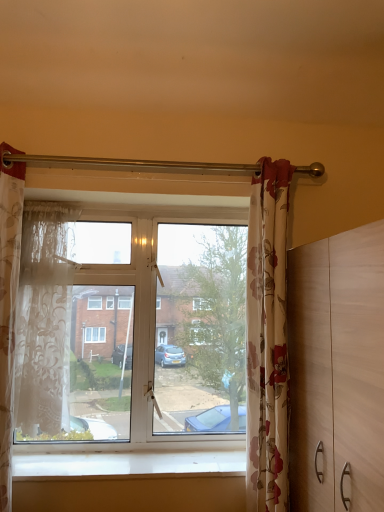
You are a GUI agent. You are given a task and a screenshot of the screen. Output one action in this format:
    pyautogui.click(x=<x>, y=<y>)
    Task: Click on the white smooth window sill at lower center
    This screenshot has height=512, width=384.
    Given the screenshot: What is the action you would take?
    pyautogui.click(x=129, y=464)

Measure the distance between light brown wooden dresser at right and camera.

The depth of light brown wooden dresser at right is 35.26 inches.

This screenshot has height=512, width=384. What are the coordinates of `light brown wooden dresser at right` in the screenshot? It's located at (337, 371).

At what (x,y) coordinates should I click in order to perform the action: click on sheer white lace curtain at left, the second curtain when ordered from left to right. Please return your answer as a coordinate pair (x, y). This screenshot has width=384, height=512. Looking at the image, I should click on (44, 321).

Identify the location of floral fabric curtain at right, which is counted as the first curtain, starting from the right. This screenshot has width=384, height=512. (267, 339).

Find the location of a particular element. The width and height of the screenshot is (384, 512). white smooth window sill at lower center is located at coordinates (129, 464).

Is translucent floral fabric curtain at left, the 3th curtain viewed from the right, facing towards sheer white lace curtain at left, the second curtain when ordered from left to right?

No, translucent floral fabric curtain at left, the 3th curtain viewed from the right, is not aimed at sheer white lace curtain at left, the second curtain when ordered from left to right.

Between translucent floral fabric curtain at left, the first curtain from the left, and sheer white lace curtain at left, the 2th curtain from the right, which one has smaller width?

With smaller width is sheer white lace curtain at left, the 2th curtain from the right.

Find the location of a particular element. The height and width of the screenshot is (512, 384). curtain on the left of sheer white lace curtain at left, the second curtain when ordered from left to right is located at coordinates (8, 306).

From the image's perspective, which one is positioned higher, sheer white lace curtain at left, the 2th curtain from the right, or transparent glass window at center?

sheer white lace curtain at left, the 2th curtain from the right, from the image's perspective.

Consider the image. From a real-world perspective, who is located lower, sheer white lace curtain at left, the second curtain when ordered from left to right, or transparent glass window at center?

transparent glass window at center is physically lower.

Does sheer white lace curtain at left, the 2th curtain from the right, contain transparent glass window at center?

No, sheer white lace curtain at left, the 2th curtain from the right, does not contain transparent glass window at center.

Is sheer white lace curtain at left, the second curtain when ordered from left to right, facing towards transparent glass window at center?

No.

Which is more to the left, light brown wooden dresser at right or transparent glass window at center?

From the viewer's perspective, transparent glass window at center appears more on the left side.

From a real-world perspective, which is physically below, light brown wooden dresser at right or transparent glass window at center?

light brown wooden dresser at right, from a real-world perspective.

Considering the relative sizes of light brown wooden dresser at right and transparent glass window at center in the image provided, is light brown wooden dresser at right bigger than transparent glass window at center?

Yes.

Is transparent glass window at center next to translucent floral fabric curtain at left, the first curtain from the left?

No, transparent glass window at center is not in contact with translucent floral fabric curtain at left, the first curtain from the left.

Considering the relative positions of transparent glass window at center and translucent floral fabric curtain at left, the first curtain from the left, in the image provided, is transparent glass window at center to the right of translucent floral fabric curtain at left, the first curtain from the left, from the viewer's perspective?

→ Indeed, transparent glass window at center is positioned on the right side of translucent floral fabric curtain at left, the first curtain from the left.

From the picture: Is transparent glass window at center inside the boundaries of translucent floral fabric curtain at left, the 3th curtain viewed from the right, or outside?

The correct answer is: outside.

Is light brown wooden dresser at right bigger or smaller than translucent floral fabric curtain at left, the first curtain from the left?

Clearly, light brown wooden dresser at right is larger in size than translucent floral fabric curtain at left, the first curtain from the left.

Is point (330, 499) farther from viewer compared to point (4, 204)?

That is False.

Is the depth of light brown wooden dresser at right less than that of translucent floral fabric curtain at left, the 3th curtain viewed from the right?

That is True.

Does light brown wooden dresser at right have a lesser height compared to white smooth window sill at lower center?

No, light brown wooden dresser at right is not shorter than white smooth window sill at lower center.

Which is in front, point (306, 371) or point (34, 457)?

Point (306, 371)

Locate an element on the screen. The width and height of the screenshot is (384, 512). dresser above the white smooth window sill at lower center (from the image's perspective) is located at coordinates (337, 371).

From a real-world perspective, is light brown wooden dresser at right positioned under white smooth window sill at lower center based on gravity?

Actually, light brown wooden dresser at right is physically above white smooth window sill at lower center in the real world.

Is there a large distance between floral fabric curtain at right, which is counted as the first curtain, starting from the right, and white smooth window sill at lower center?

No, there isn't a large distance between floral fabric curtain at right, which is counted as the first curtain, starting from the right, and white smooth window sill at lower center.

Looking at this image, is floral fabric curtain at right, which ranks as the third curtain in left-to-right order, not inside white smooth window sill at lower center?

Yes, floral fabric curtain at right, which ranks as the third curtain in left-to-right order, is outside of white smooth window sill at lower center.

Considering the points (272, 416) and (143, 459), which point is behind, point (272, 416) or point (143, 459)?

The point (143, 459) is more distant.

This screenshot has height=512, width=384. Identify the location of curtain that is the 1st one when counting rightward from the translucent floral fabric curtain at left, the first curtain from the left. (44, 321).

Find the location of a particular element. Image resolution: width=384 pixels, height=512 pixels. window lying below the sheer white lace curtain at left, the 2th curtain from the right (from the image's perspective) is located at coordinates (137, 343).

Looking at the image, which one is located closer to white smooth window sill at lower center, sheer white lace curtain at left, the second curtain when ordered from left to right, or light brown wooden dresser at right?

The object closer to white smooth window sill at lower center is sheer white lace curtain at left, the second curtain when ordered from left to right.

From the picture: Based on their spatial positions, is sheer white lace curtain at left, the second curtain when ordered from left to right, or floral fabric curtain at right, which ranks as the third curtain in left-to-right order, further from light brown wooden dresser at right?

sheer white lace curtain at left, the second curtain when ordered from left to right, lies further to light brown wooden dresser at right than the other object.

Considering their positions, is white smooth window sill at lower center positioned further to floral fabric curtain at right, which ranks as the third curtain in left-to-right order, than translucent floral fabric curtain at left, the first curtain from the left?

translucent floral fabric curtain at left, the first curtain from the left, lies further to floral fabric curtain at right, which ranks as the third curtain in left-to-right order, than the other object.

Estimate the real-world distances between objects in this image. Which object is closer to sheer white lace curtain at left, the second curtain when ordered from left to right, transparent glass window at center or floral fabric curtain at right, which is counted as the first curtain, starting from the right?

The object closer to sheer white lace curtain at left, the second curtain when ordered from left to right, is transparent glass window at center.

Based on their spatial positions, is white smooth window sill at lower center or transparent glass window at center further from light brown wooden dresser at right?

Based on the image, transparent glass window at center appears to be further to light brown wooden dresser at right.

Which object lies further to the anchor point white smooth window sill at lower center, translucent floral fabric curtain at left, the first curtain from the left, or transparent glass window at center?

translucent floral fabric curtain at left, the first curtain from the left, is further to white smooth window sill at lower center.

Considering their positions, is translucent floral fabric curtain at left, the 3th curtain viewed from the right, positioned closer to floral fabric curtain at right, which ranks as the third curtain in left-to-right order, than transparent glass window at center?

Among the two, transparent glass window at center is located nearer to floral fabric curtain at right, which ranks as the third curtain in left-to-right order.

Considering their positions, is white smooth window sill at lower center positioned closer to sheer white lace curtain at left, the second curtain when ordered from left to right, than translucent floral fabric curtain at left, the 3th curtain viewed from the right?

Among the two, translucent floral fabric curtain at left, the 3th curtain viewed from the right, is located nearer to sheer white lace curtain at left, the second curtain when ordered from left to right.

Find the location of a particular element. window between sheer white lace curtain at left, the 2th curtain from the right, and floral fabric curtain at right, which is counted as the first curtain, starting from the right is located at coordinates (137, 343).

Identify the location of window between translucent floral fabric curtain at left, the 3th curtain viewed from the right, and floral fabric curtain at right, which is counted as the first curtain, starting from the right, in the horizontal direction. (137, 343).

Find the location of a particular element. The width and height of the screenshot is (384, 512). curtain situated between sheer white lace curtain at left, the 2th curtain from the right, and light brown wooden dresser at right from left to right is located at coordinates (267, 339).

Image resolution: width=384 pixels, height=512 pixels. In order to click on window between sheer white lace curtain at left, the second curtain when ordered from left to right, and white smooth window sill at lower center, in the vertical direction in this screenshot , I will do `click(137, 343)`.